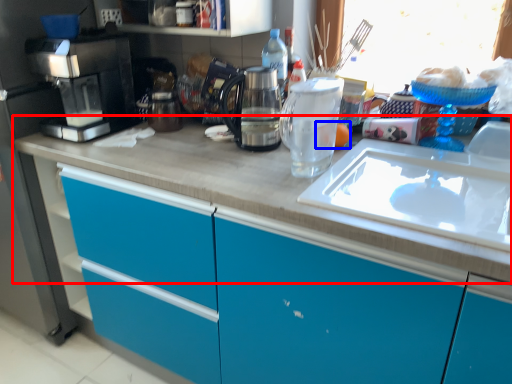
Question: Which object is further to the camera taking this photo, countertop (highlighted by a red box) or food (highlighted by a blue box)?

Choices:
 (A) countertop
 (B) food

Answer: (B)